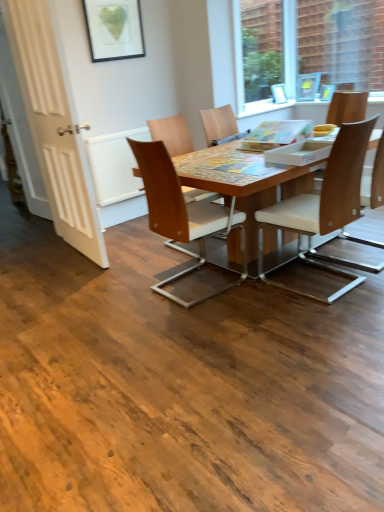
Locate an element on the screen. free space in front of wooden chair with white cushion at center, marked as the third chair in a right-to-left arrangement is located at coordinates (330, 323).